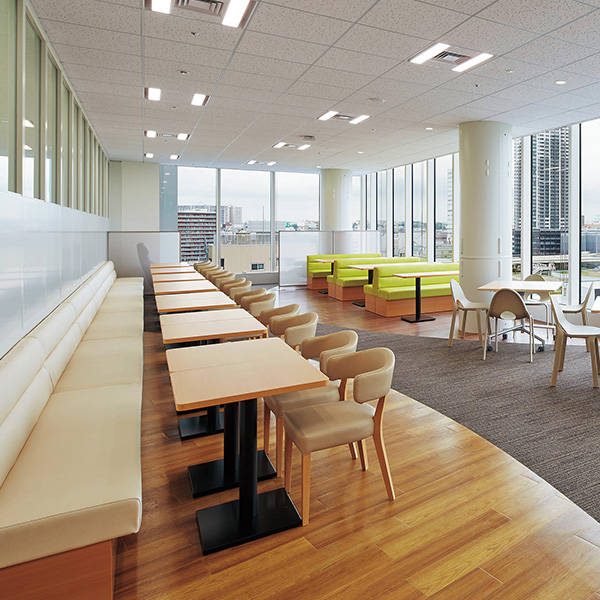
You are a GUI agent. You are given a task and a screenshot of the screen. Output one action in this format:
    pyautogui.click(x=<x>, y=<y>)
    Task: Click on the hard chairs
    
    Given the screenshot: What is the action you would take?
    pyautogui.click(x=575, y=321), pyautogui.click(x=582, y=299), pyautogui.click(x=534, y=302), pyautogui.click(x=505, y=313), pyautogui.click(x=473, y=304)